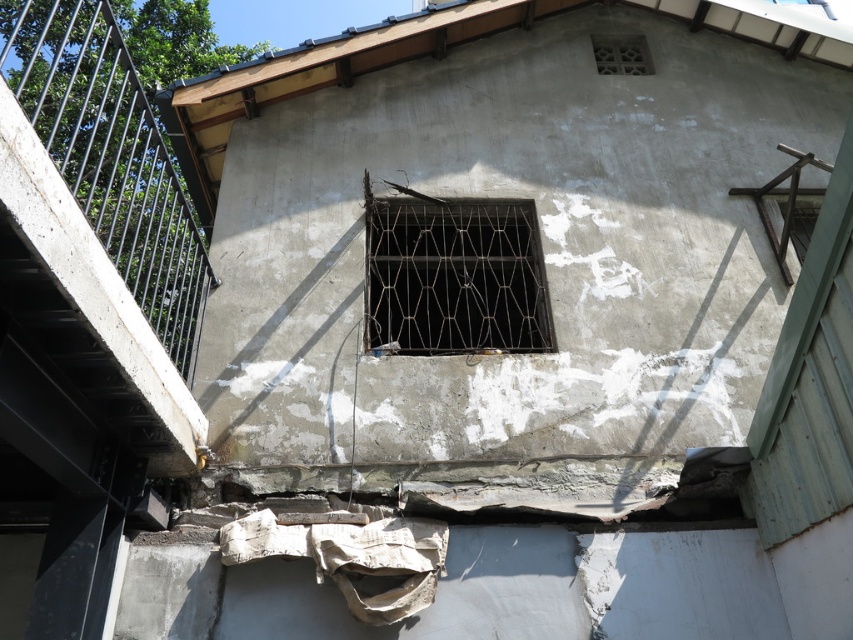
Which of these two, black metal grid at center or white textured vent at upper center, stands shorter?

white textured vent at upper center is shorter.

Is black metal grid at center bigger than white textured vent at upper center?

Indeed, black metal grid at center has a larger size compared to white textured vent at upper center.

The image size is (853, 640). Describe the element at coordinates (453, 276) in the screenshot. I see `black metal grid at center` at that location.

This screenshot has height=640, width=853. In order to click on black metal grid at center in this screenshot , I will do `click(453, 276)`.

Who is higher up, black metal railing at upper left or white textured vent at upper center?

black metal railing at upper left

Between black metal railing at upper left and white textured vent at upper center, which one appears on the right side from the viewer's perspective?

From the viewer's perspective, white textured vent at upper center appears more on the right side.

Is point (158, 132) closer to viewer compared to point (602, 65)?

Yes.

This screenshot has height=640, width=853. What are the coordinates of `black metal railing at upper left` in the screenshot? It's located at (109, 156).

Is point (4, 12) more distant than point (457, 237)?

Yes.

Is black metal railing at upper left wider than black metal grid at center?

In fact, black metal railing at upper left might be narrower than black metal grid at center.

Is point (90, 216) farther from viewer compared to point (492, 340)?

Yes, point (90, 216) is farther from viewer.

Where is `black metal railing at upper left`? The image size is (853, 640). black metal railing at upper left is located at coordinates (109, 156).